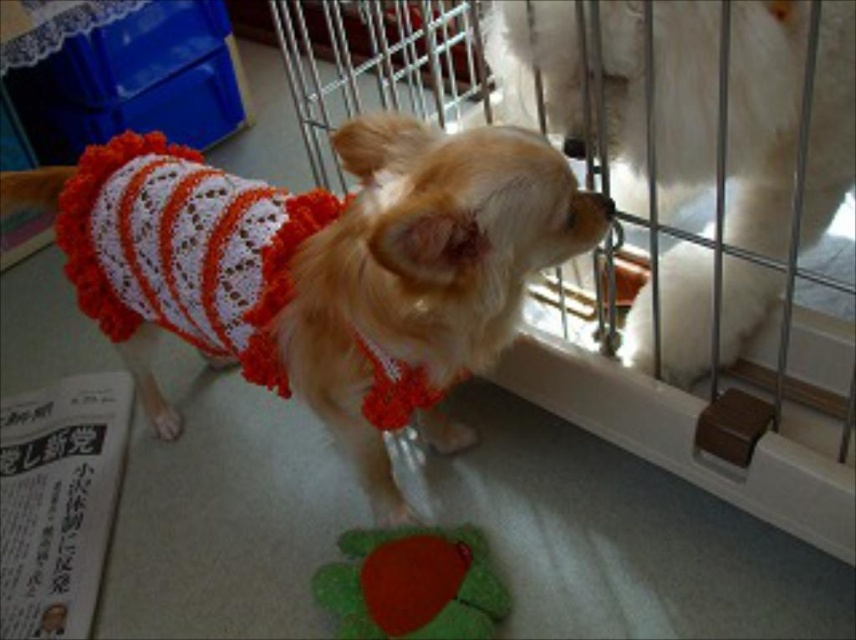
Question: Which object is closer to the camera taking this photo?

Choices:
 (A) white fluffy dog at center
 (B) velvety green plush toy at center
 (C) metal wire cage at center

Answer: (C)

Question: Can you confirm if white crochet dress at center is positioned to the left of metal wire cage at center?

Choices:
 (A) yes
 (B) no

Answer: (A)

Question: Which of the following is the closest to the observer?

Choices:
 (A) metal wire cage at center
 (B) white crochet dress at center

Answer: (B)

Question: Can you confirm if white crochet dress at center is wider than metal wire cage at center?

Choices:
 (A) no
 (B) yes

Answer: (A)

Question: Which point is farther from the camera taking this photo?

Choices:
 (A) (749, 56)
 (B) (97, 147)
 (C) (384, 624)
 (D) (580, 358)

Answer: (B)

Question: In this image, where is metal wire cage at center located relative to velvety green plush toy at center?

Choices:
 (A) right
 (B) left

Answer: (A)